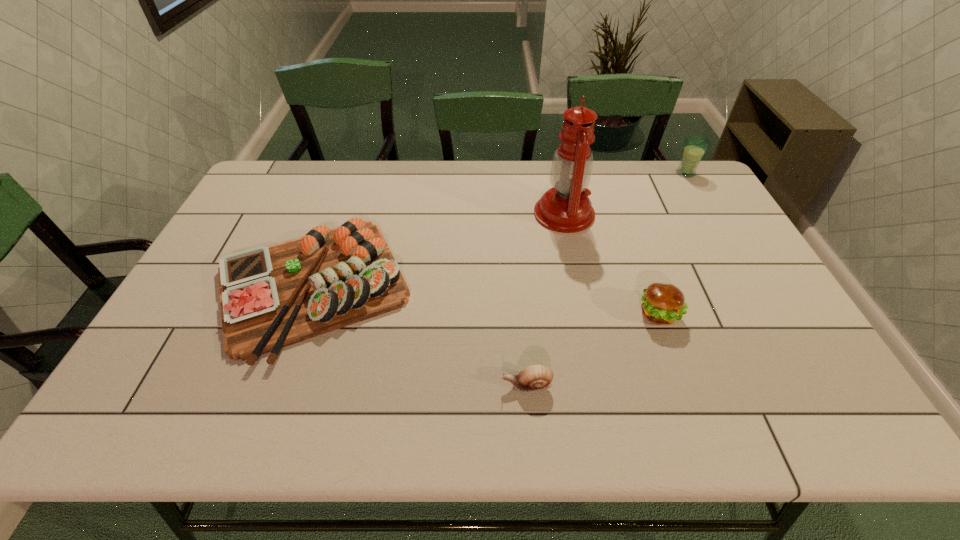
The image size is (960, 540). In the image, there is a desktop. Find the location of `free space at the far edge`. free space at the far edge is located at coordinates (451, 173).

Identify the location of vacant space at the near edge of the desktop. This screenshot has width=960, height=540. (690, 433).

Locate an element on the screen. Image resolution: width=960 pixels, height=540 pixels. vacant space at the right edge of the desktop is located at coordinates (699, 215).

Image resolution: width=960 pixels, height=540 pixels. What are the coordinates of `blank space at the near left corner of the desktop` in the screenshot? It's located at (109, 424).

In the image, there is a desktop. Where is `vacant area at the near right corner`? vacant area at the near right corner is located at coordinates (793, 422).

Where is `unoccupied area between the escargot and the hamburger`? This screenshot has width=960, height=540. unoccupied area between the escargot and the hamburger is located at coordinates (593, 350).

At what (x,y) coordinates should I click in order to perform the action: click on vacant point located between the third object from right to left and the hamburger. Please return your answer as a coordinate pair (x, y). The height and width of the screenshot is (540, 960). Looking at the image, I should click on (612, 264).

You are a GUI agent. You are given a task and a screenshot of the screen. Output one action in this format:
    pyautogui.click(x=<x>, y=<y>)
    Task: Click on the free space between the oil lamp and the second object from right to left
    
    Given the screenshot: What is the action you would take?
    pyautogui.click(x=612, y=264)

Identify the location of free point between the leftmost object and the fourth object from left to right. click(486, 300).

Identify the location of unoccupied area between the second object from left to right and the farthest object. click(x=607, y=279).